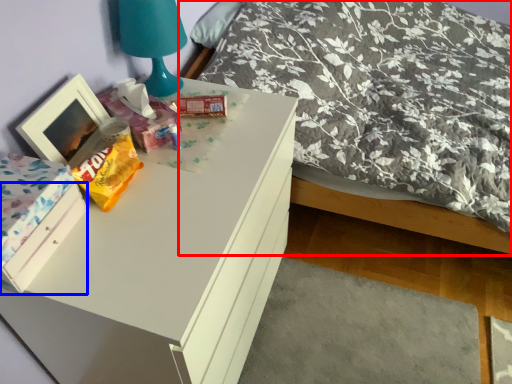
Question: Which point is further to the camera, bed (highlighted by a red box) or drawer (highlighted by a blue box)?

Choices:
 (A) bed
 (B) drawer

Answer: (A)